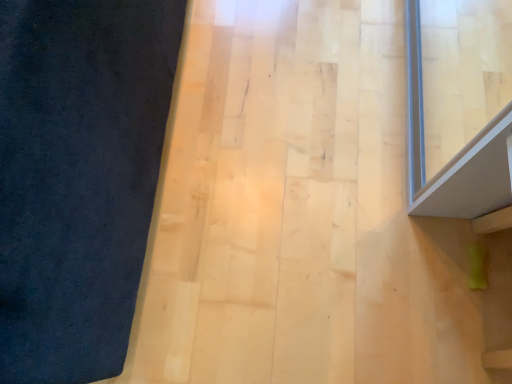
In order to click on dark matte fabric at left in this screenshot , I will do `click(78, 177)`.

The width and height of the screenshot is (512, 384). What do you see at coordinates (78, 177) in the screenshot?
I see `dark matte fabric at left` at bounding box center [78, 177].

The width and height of the screenshot is (512, 384). Find the location of `dark matte fabric at left`. dark matte fabric at left is located at coordinates (78, 177).